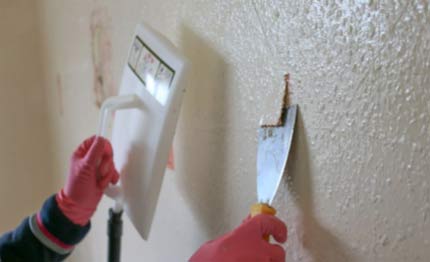
Locate an element on the screen. The height and width of the screenshot is (262, 430). paint separating from wall is located at coordinates (280, 100).